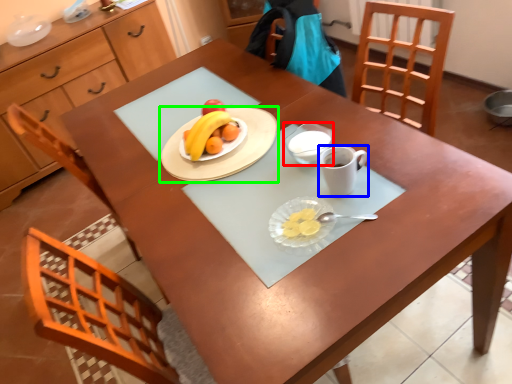
Question: Based on their relative distances, which object is farther from glass bowl (highlighted by a red box)? Choose from coffee cup (highlighted by a blue box) and tableware (highlighted by a green box).

Choices:
 (A) coffee cup
 (B) tableware

Answer: (B)